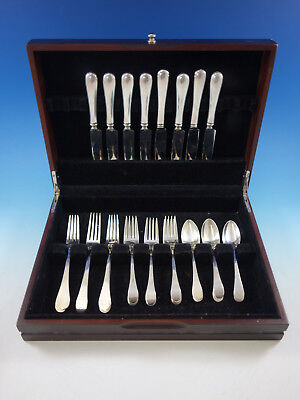
This screenshot has height=400, width=300. I want to click on forks, so coord(65,288), coord(78,298), coord(108,301), coord(127,293), coord(147,293), coord(176,293).